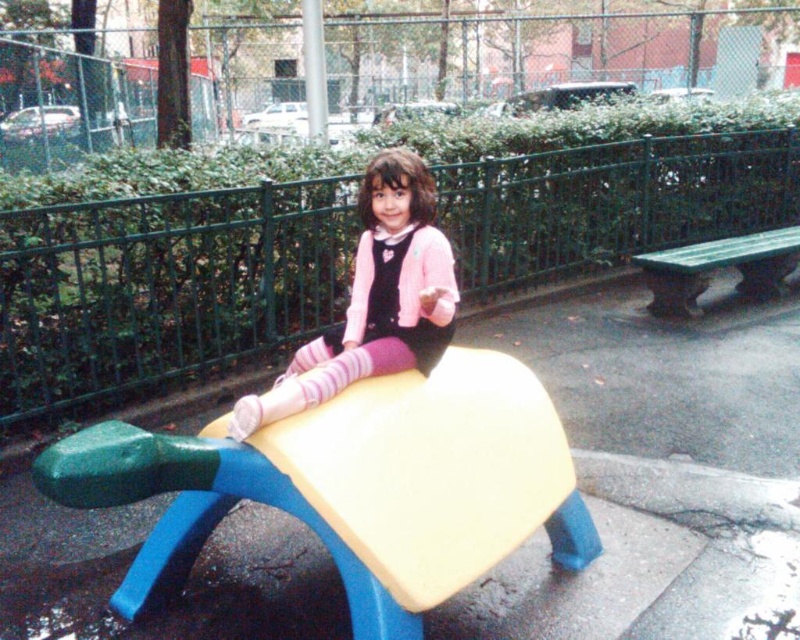
Can you confirm if pink matte sweater at center is smaller than green plastic bench at right?

Correct, pink matte sweater at center occupies less space than green plastic bench at right.

Is point (433, 224) behind point (728, 253)?

No.

Describe the element at coordinates (376, 298) in the screenshot. I see `pink matte sweater at center` at that location.

At what (x,y) coordinates should I click in order to perform the action: click on pink matte sweater at center. Please return your answer as a coordinate pair (x, y). Image resolution: width=800 pixels, height=640 pixels. Looking at the image, I should click on [376, 298].

The image size is (800, 640). Describe the element at coordinates (354, 484) in the screenshot. I see `yellow plastic bench at center` at that location.

Can you confirm if yellow plastic bench at center is wider than green plastic bench at right?

No, yellow plastic bench at center is not wider than green plastic bench at right.

Where is `yellow plastic bench at center`? yellow plastic bench at center is located at coordinates (354, 484).

This screenshot has width=800, height=640. I want to click on yellow plastic bench at center, so click(354, 484).

Which is behind, point (302, 496) or point (442, 266)?

The point (442, 266) is behind.

Can you confirm if yellow plastic bench at center is positioned to the right of pink matte sweater at center?

In fact, yellow plastic bench at center is to the left of pink matte sweater at center.

Measure the distance between yellow plastic bench at center and camera.

A distance of 1.67 meters exists between yellow plastic bench at center and camera.

Where is `yellow plastic bench at center`? The image size is (800, 640). yellow plastic bench at center is located at coordinates (354, 484).